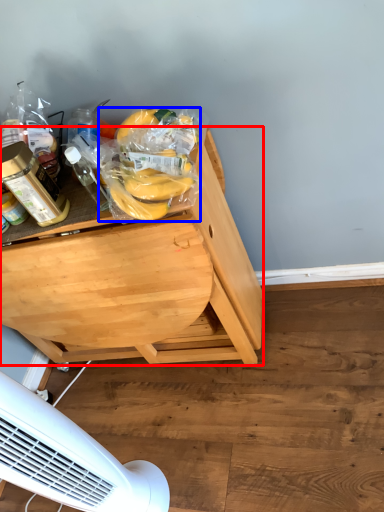
Question: Among these objects, which one is farthest to the camera, desk (highlighted by a red box) or food (highlighted by a blue box)?

Choices:
 (A) desk
 (B) food

Answer: (A)